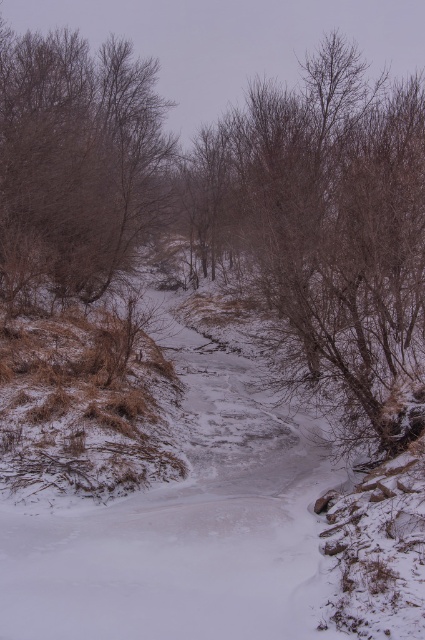
Question: Can you confirm if brown/dry wood at center is positioned to the right of brown/dry wood at upper left?

Choices:
 (A) yes
 (B) no

Answer: (A)

Question: Does brown/dry wood at center appear on the left side of brown/dry wood at upper left?

Choices:
 (A) no
 (B) yes

Answer: (A)

Question: Which point is closer to the camera?

Choices:
 (A) (124, 157)
 (B) (207, 202)

Answer: (A)

Question: Is brown/dry wood at center thinner than brown/dry wood at upper left?

Choices:
 (A) yes
 (B) no

Answer: (B)